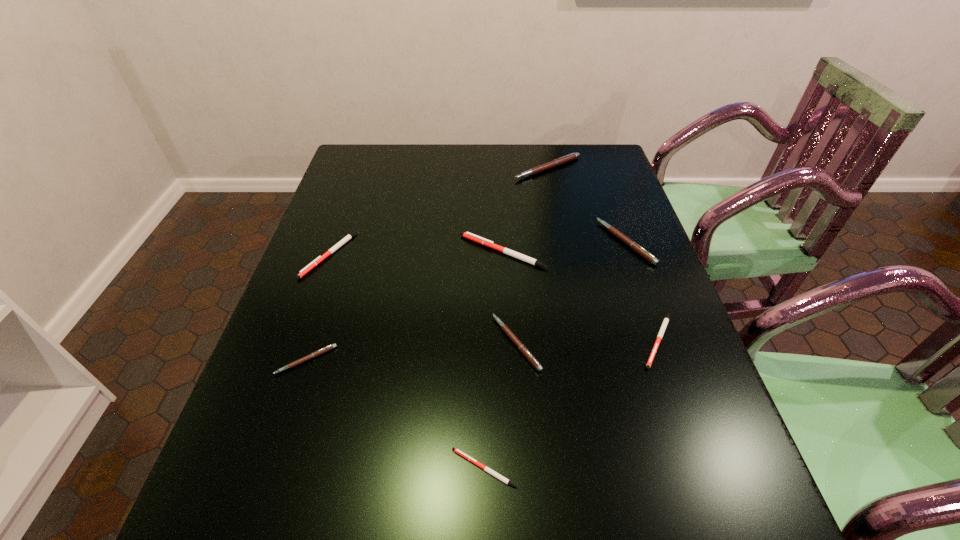
Locate an element on the screen. The height and width of the screenshot is (540, 960). the nearest object is located at coordinates (485, 468).

You are a GUI agent. You are given a task and a screenshot of the screen. Output one action in this format:
    pyautogui.click(x=<x>, y=<y>)
    Task: Click on the blank area located at the nib of the tallest object
    
    Given the screenshot: What is the action you would take?
    pyautogui.click(x=566, y=261)

Identify the location of free space located 0.190m at the nib of the third smallest pink pen. This screenshot has height=540, width=960. (534, 242).

The height and width of the screenshot is (540, 960). I want to click on vacant space located 0.200m at the nib of the third smallest pink pen, so click(x=530, y=242).

At what (x,y) coordinates should I click in order to perform the action: click on free space located at the nib of the third smallest pink pen. Please return your answer as a coordinate pair (x, y). The image size is (960, 540). Looking at the image, I should click on (465, 242).

You are a GUI agent. You are given a task and a screenshot of the screen. Output one action in this format:
    pyautogui.click(x=<x>, y=<y>)
    Task: Click on the free location located 0.150m on the clicker of the biggest white pen
    Image resolution: width=960 pixels, height=540 pixels.
    Given the screenshot: What is the action you would take?
    pyautogui.click(x=404, y=252)

At what (x,y) coordinates should I click in order to perform the action: click on free space located 0.290m on the clicker of the biggest white pen. Please return your answer as a coordinate pair (x, y). Looking at the image, I should click on (352, 252).

The width and height of the screenshot is (960, 540). What are the coordinates of `free spot located on the clicker of the biggest white pen` in the screenshot? It's located at point(371,252).

This screenshot has width=960, height=540. I want to click on free space located at the nib of the third biggest pink pen, so click(362, 343).

Where is `vacant space located at the nib of the third biggest pink pen`? This screenshot has height=540, width=960. vacant space located at the nib of the third biggest pink pen is located at coordinates (407, 343).